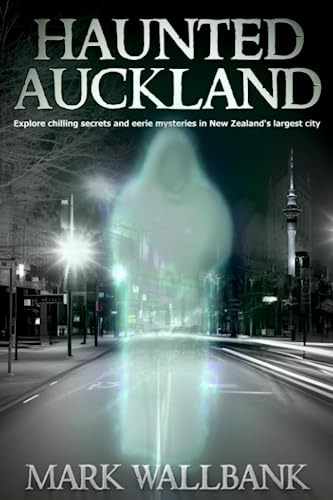
The height and width of the screenshot is (500, 333). I want to click on light sources, so click(x=74, y=252), click(x=115, y=273), click(x=98, y=192), click(x=327, y=233).